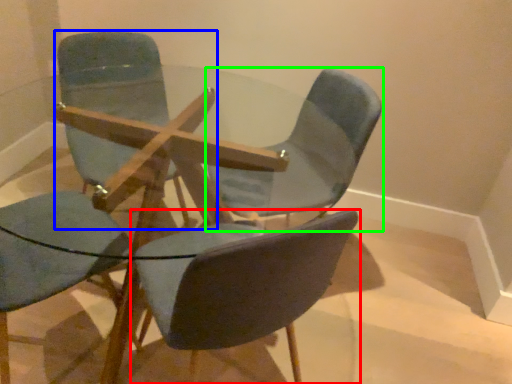
Question: Which object is the closest to the chair (highlighted by a red box)? Choose among these: chair (highlighted by a blue box) or chair (highlighted by a green box).

Choices:
 (A) chair
 (B) chair

Answer: (B)